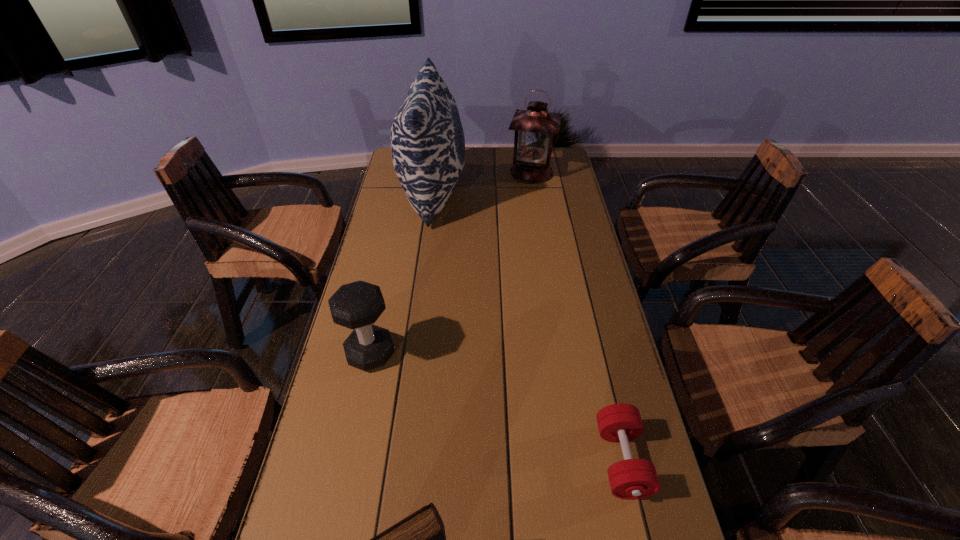
At what (x,y) coordinates should I click in order to perform the action: click on cushion. Please return your answer as a coordinate pair (x, y). This screenshot has width=960, height=540. Looking at the image, I should click on (427, 140).

Where is `the second tallest object`? the second tallest object is located at coordinates (535, 127).

Identify the location of the left dumbbell. This screenshot has height=540, width=960. (357, 305).

At what (x,y) coordinates should I click in order to perform the action: click on the farther dumbbell. Please return your answer as a coordinate pair (x, y). The height and width of the screenshot is (540, 960). Looking at the image, I should click on (357, 305).

This screenshot has width=960, height=540. Find the location of `the shorter dumbbell`. the shorter dumbbell is located at coordinates (630, 478).

This screenshot has width=960, height=540. Identify the location of the nearer dumbbell. (630, 478).

Where is `free space located 0.400m on the front surface of the tallest object`? The width and height of the screenshot is (960, 540). free space located 0.400m on the front surface of the tallest object is located at coordinates (569, 193).

Find the location of a particular element. free point located on the left of the fourth shortest object is located at coordinates (464, 172).

The width and height of the screenshot is (960, 540). In order to click on free space located on the front of the left dumbbell in this screenshot , I will do `click(351, 443)`.

Find the location of a particular element. free space located on the back of the nearer dumbbell is located at coordinates (585, 302).